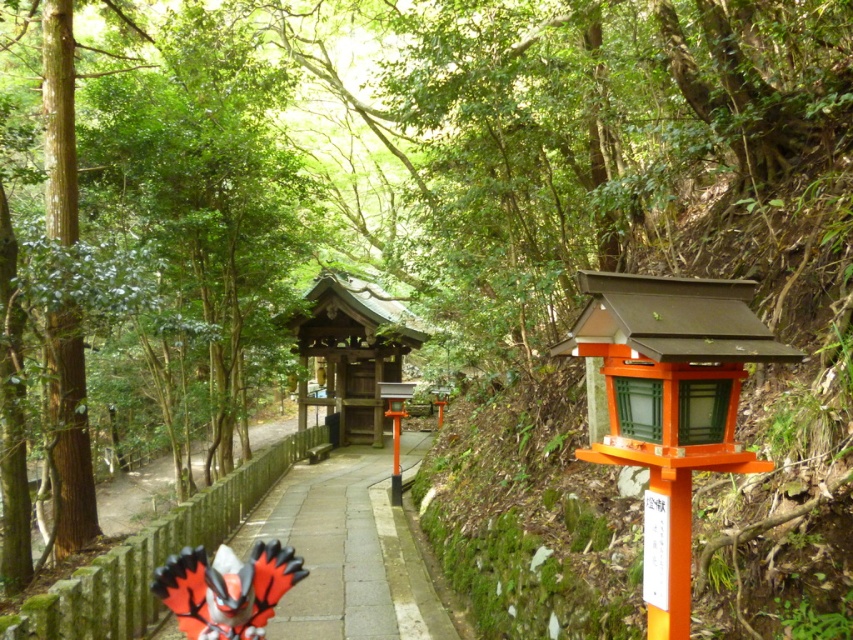
Question: Does smooth stone path at center come in front of orange matte butterfly at lower left?

Choices:
 (A) no
 (B) yes

Answer: (A)

Question: Which of the following is the farthest from the observer?

Choices:
 (A) (213, 596)
 (B) (265, 525)

Answer: (B)

Question: Among these objects, which one is farthest from the camera?

Choices:
 (A) orange matte butterfly at lower left
 (B) smooth stone path at center

Answer: (B)

Question: Observing the image, what is the correct spatial positioning of smooth stone path at center in reference to orange matte butterfly at lower left?

Choices:
 (A) above
 (B) below

Answer: (B)

Question: Does smooth stone path at center have a greater width compared to orange matte butterfly at lower left?

Choices:
 (A) no
 (B) yes

Answer: (B)